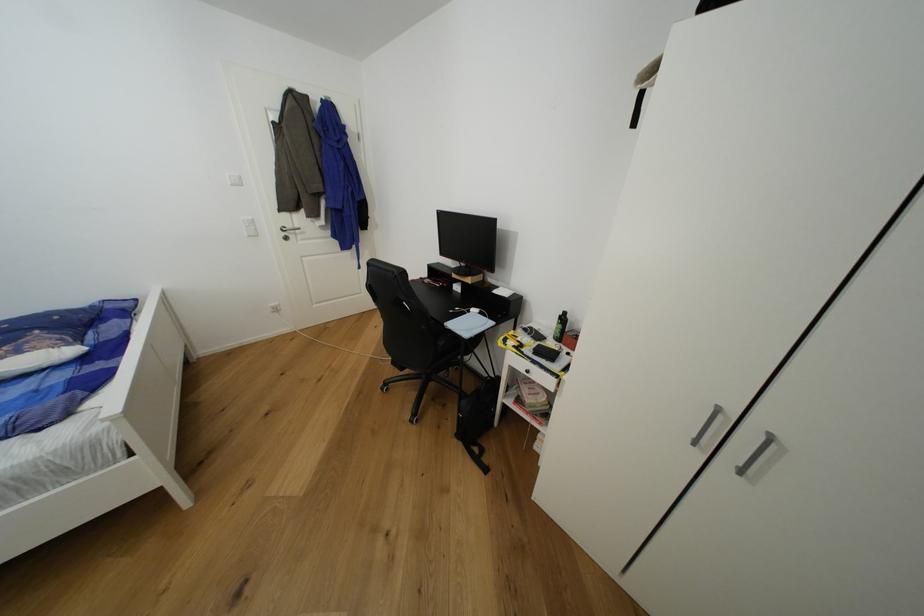
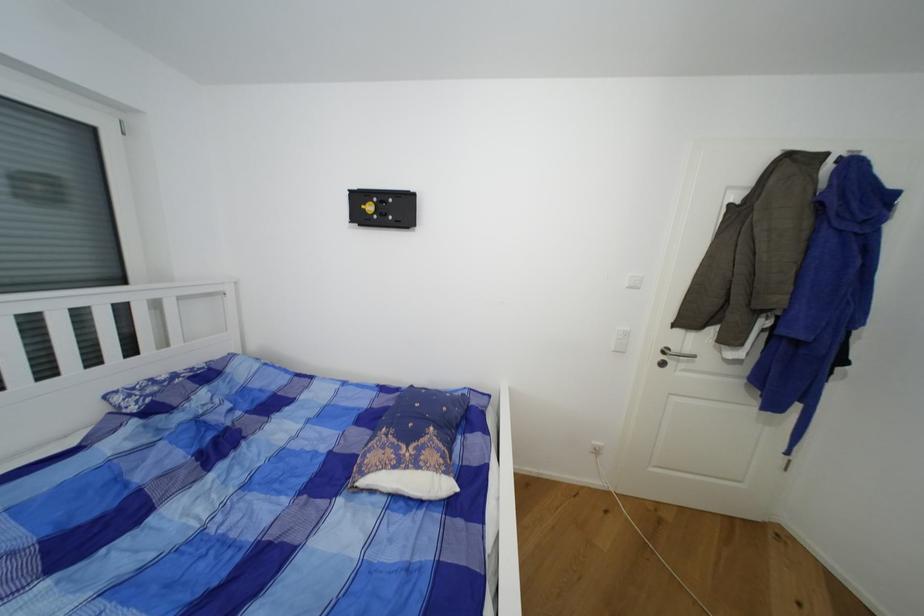
In the second image, find the point that corresponds to [79,353] in the first image.

(454, 488)